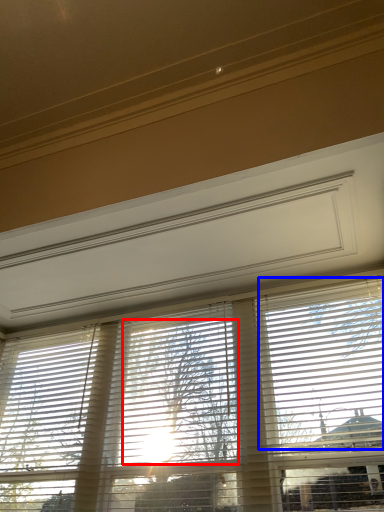
Question: Which of the following is the farthest to the observer, tree (highlighted by a red box) or blind (highlighted by a blue box)?

Choices:
 (A) tree
 (B) blind

Answer: (A)